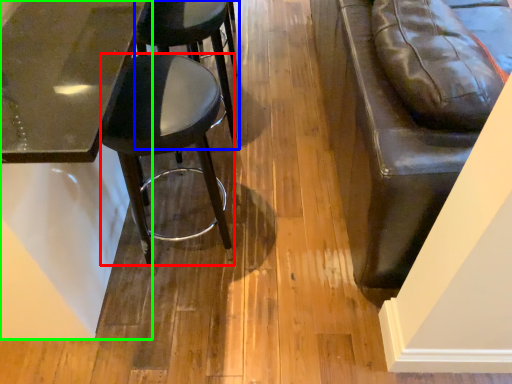
Question: Which object is positioned closest to stool (highlighted by a red box)? Select from stool (highlighted by a blue box) and table (highlighted by a green box).

Choices:
 (A) stool
 (B) table

Answer: (B)